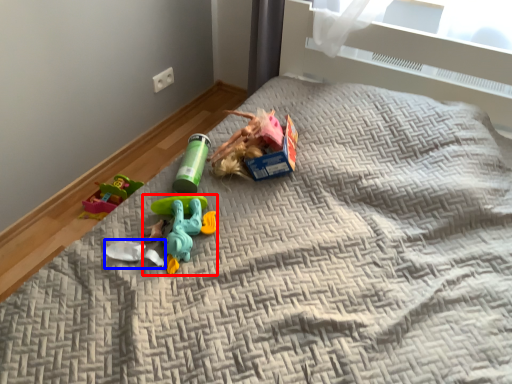
Question: Which of the following is the farthest to the observer, toy (highlighted by a red box) or toy (highlighted by a blue box)?

Choices:
 (A) toy
 (B) toy

Answer: (B)